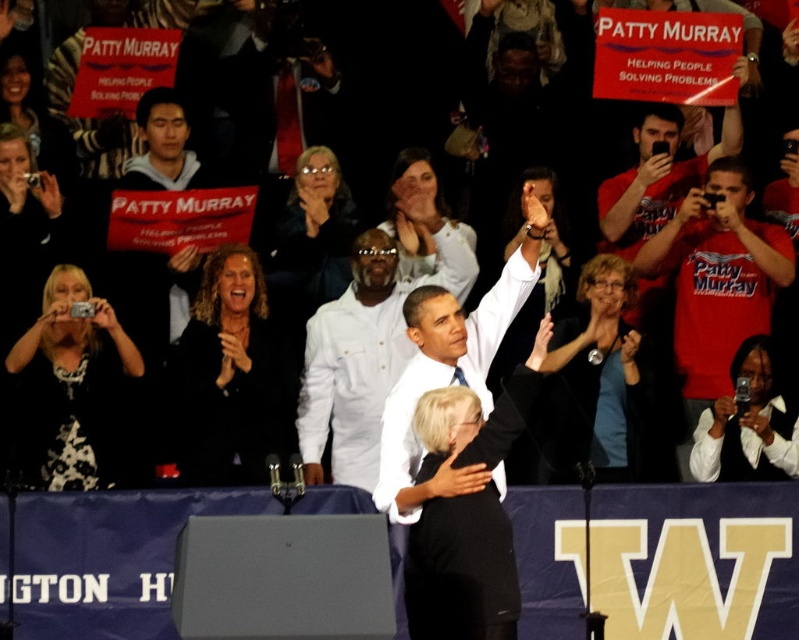
Question: Considering the real-world distances, which object is closest to the white dotted shirt at left?

Choices:
 (A) red cotton t-shirt at upper right
 (B) white shirt at center
 (C) dark blue denim jacket at center

Answer: (B)

Question: Which object is the farthest from the white dotted shirt at left?

Choices:
 (A) smooth white blouse at center
 (B) dark blue denim jacket at center

Answer: (B)

Question: Can you confirm if black fabric jacket at center is positioned below smooth white blouse at center?

Choices:
 (A) yes
 (B) no

Answer: (A)

Question: Does red cotton t-shirt at upper right have a larger size compared to white shirt at center?

Choices:
 (A) no
 (B) yes

Answer: (A)

Question: Can you confirm if black fabric jacket at center is positioned to the right of blue fabric shirt at upper center?

Choices:
 (A) yes
 (B) no

Answer: (B)

Question: Which point is farther to the camera?

Choices:
 (A) (714, 385)
 (B) (467, 268)

Answer: (B)